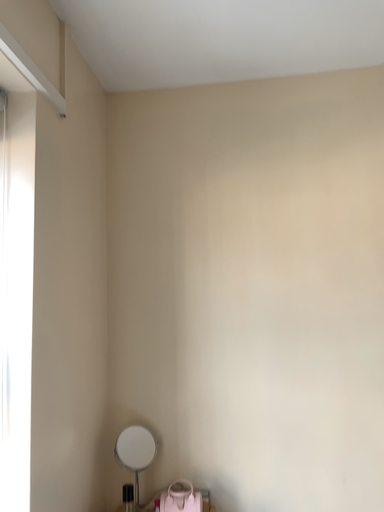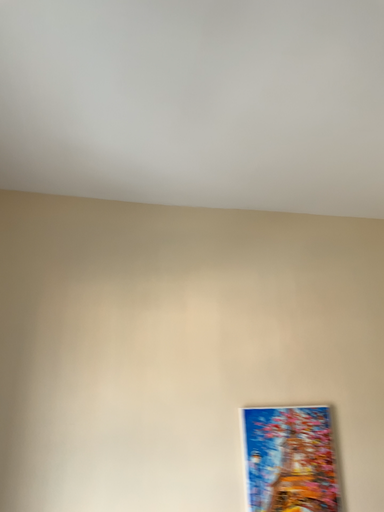
Question: Which way did the camera rotate in the video?

Choices:
 (A) rotated right
 (B) rotated left

Answer: (A)